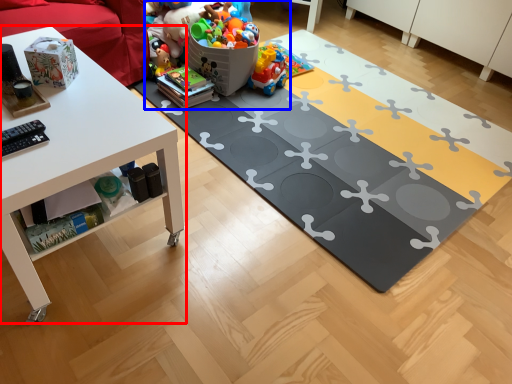
Question: Which point is further to the camera, table (highlighted by a red box) or toy (highlighted by a blue box)?

Choices:
 (A) table
 (B) toy

Answer: (B)